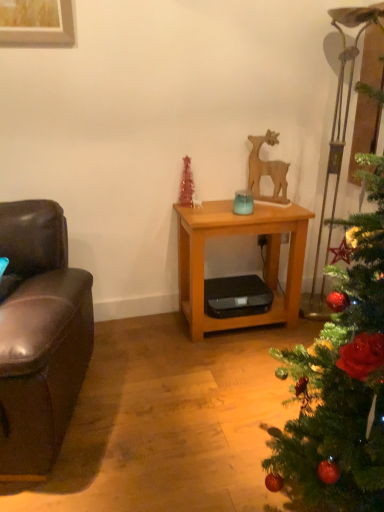
Image resolution: width=384 pixels, height=512 pixels. I want to click on free point in front of wooden table at center, so click(x=215, y=374).